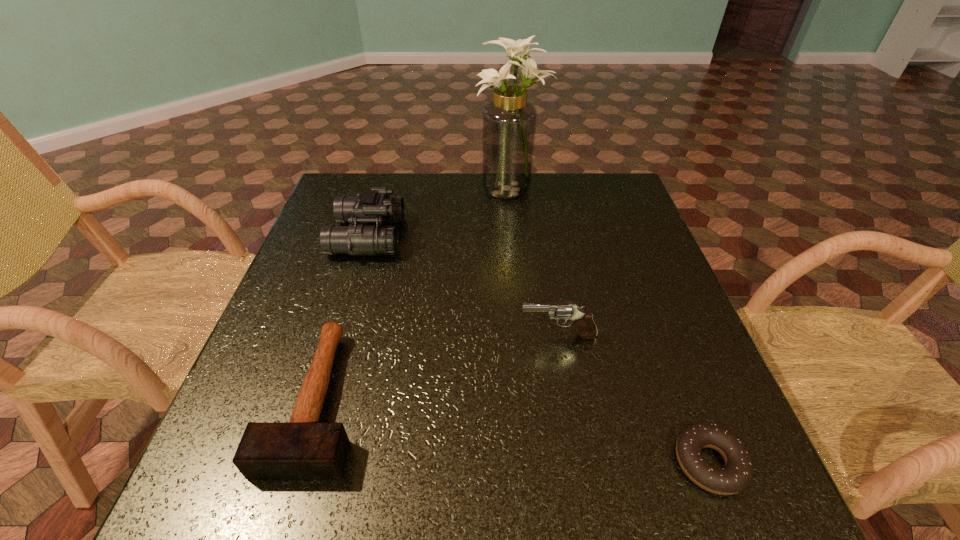
Find the location of a particular element. mallet that is positioned at the left edge is located at coordinates (303, 448).

The height and width of the screenshot is (540, 960). I want to click on object located at the right edge, so click(736, 475).

You are a GUI agent. You are given a task and a screenshot of the screen. Output one action in this format:
    pyautogui.click(x=<x>, y=<y>)
    Task: Click on the object present at the far left corner
    
    Given the screenshot: What is the action you would take?
    pyautogui.click(x=375, y=206)

In order to click on object located at the near left corner in this screenshot , I will do `click(303, 448)`.

The width and height of the screenshot is (960, 540). I want to click on object that is at the near right corner, so click(x=736, y=475).

Find the location of a particular element. This screenshot has width=960, height=540. blank space at the far edge of the desktop is located at coordinates click(475, 206).

In the image, there is a desktop. At what (x,y) coordinates should I click in order to perform the action: click on vacant space at the left edge. Please return your answer as a coordinate pair (x, y). This screenshot has width=960, height=540. Looking at the image, I should click on pyautogui.click(x=309, y=293).

At what (x,y) coordinates should I click in order to perform the action: click on vacant area at the right edge. Please return your answer as a coordinate pair (x, y). This screenshot has width=960, height=540. Looking at the image, I should click on (676, 323).

In the image, there is a desktop. Identify the location of vacant space at the far left corner. The image size is (960, 540). (372, 178).

The width and height of the screenshot is (960, 540). In the image, there is a desktop. What are the coordinates of `vacant space at the far right corner` in the screenshot? It's located at (624, 212).